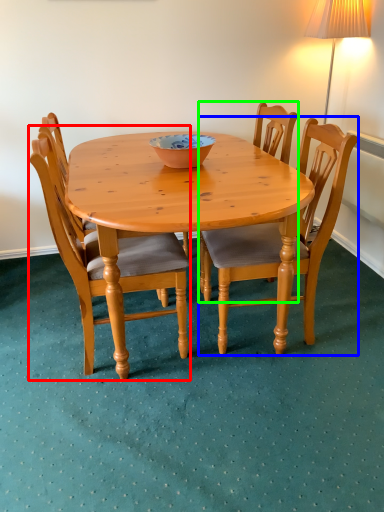
Question: Estimate the real-world distances between objects in this image. Which object is farther from chair (highlighted by a red box), chair (highlighted by a blue box) or chair (highlighted by a green box)?

Choices:
 (A) chair
 (B) chair

Answer: (A)